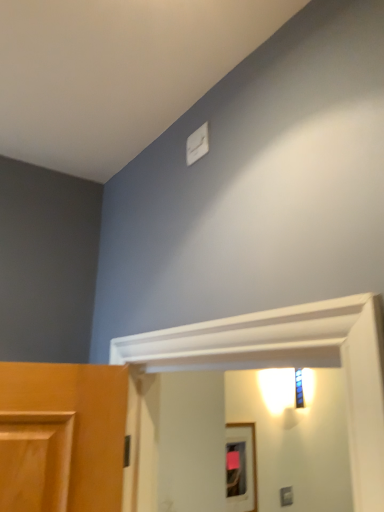
This screenshot has width=384, height=512. Describe the element at coordinates (197, 144) in the screenshot. I see `white plastic light switch at upper center` at that location.

Find the location of a particular element. The width and height of the screenshot is (384, 512). white plastic light switch at upper center is located at coordinates (197, 144).

The width and height of the screenshot is (384, 512). I want to click on white plastic light switch at upper center, so click(x=197, y=144).